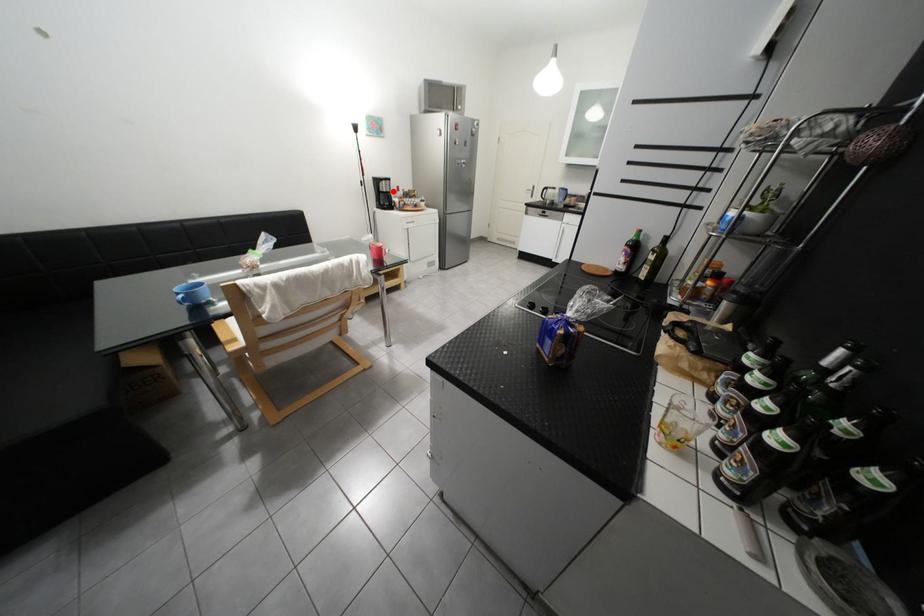
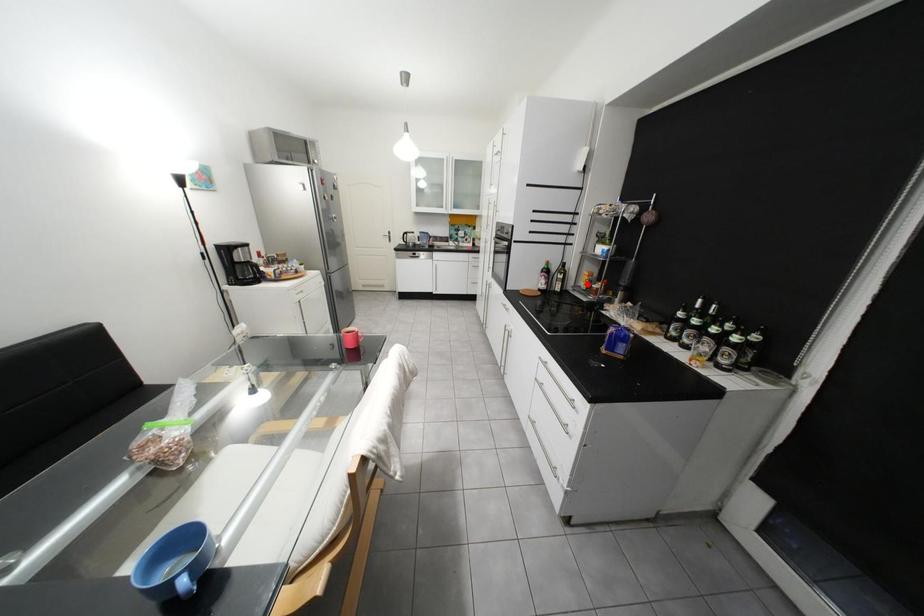
I am providing you with two images of the same scene from different viewpoints. A red point is marked on the first image and another point is marked on the second image. Is the red point in image1 aligned with the point shown in image2?

No